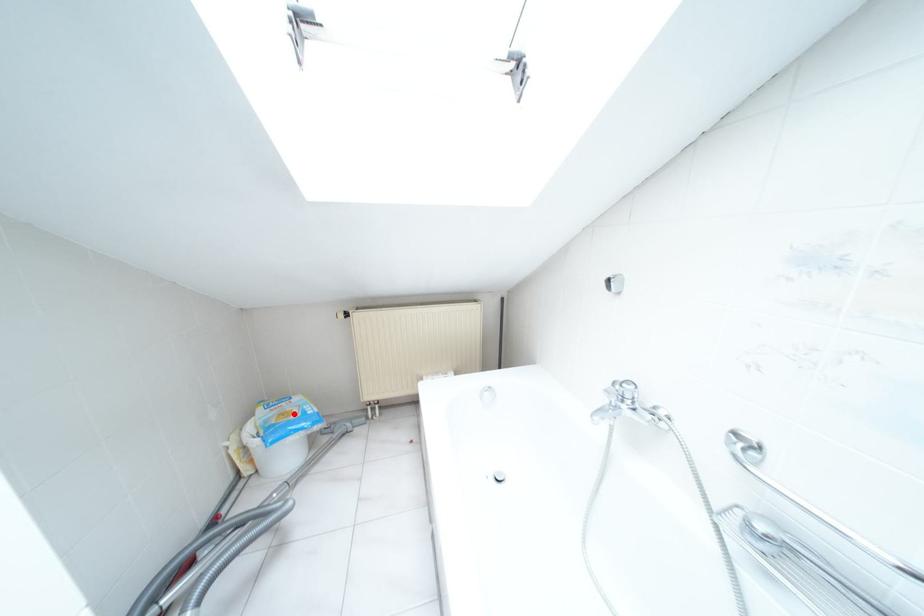
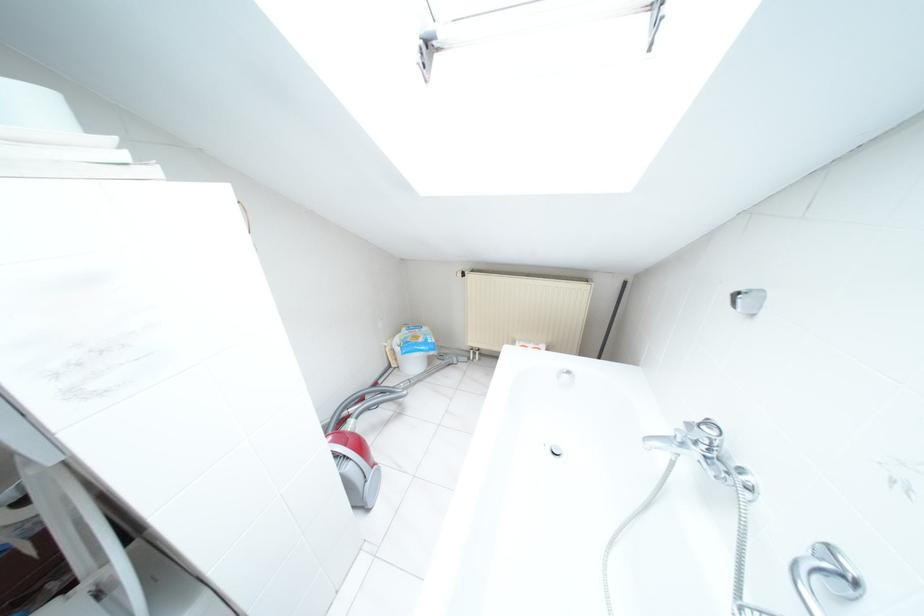
Where in the second image is the point corresponding to the highlighted location from the first image?

(419, 339)